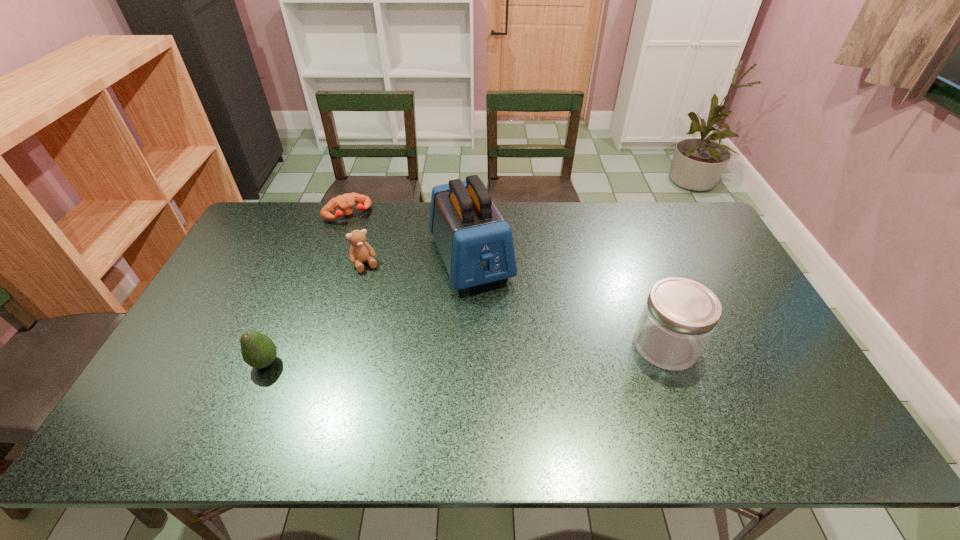
I want to click on vacant spot on the desktop that is between the avocado and the rightmost object and is positioned on the front-facing side of the teddy bear, so click(x=410, y=356).

Locate an element on the screen. This screenshot has width=960, height=540. free space on the desktop that is between the avocado and the fourth shortest object and is positioned on the front-facing side of the fourth object from left to right is located at coordinates (516, 352).

Where is `free spot on the desktop that is between the avocado and the second tallest object and is positioned with the gloves of the shortest object facing forward`? Image resolution: width=960 pixels, height=540 pixels. free spot on the desktop that is between the avocado and the second tallest object and is positioned with the gloves of the shortest object facing forward is located at coordinates (437, 355).